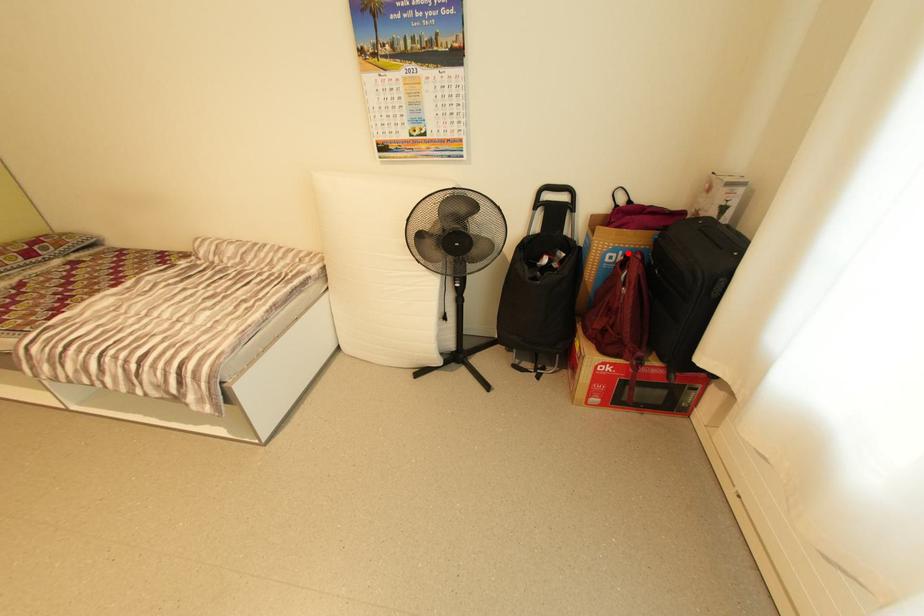
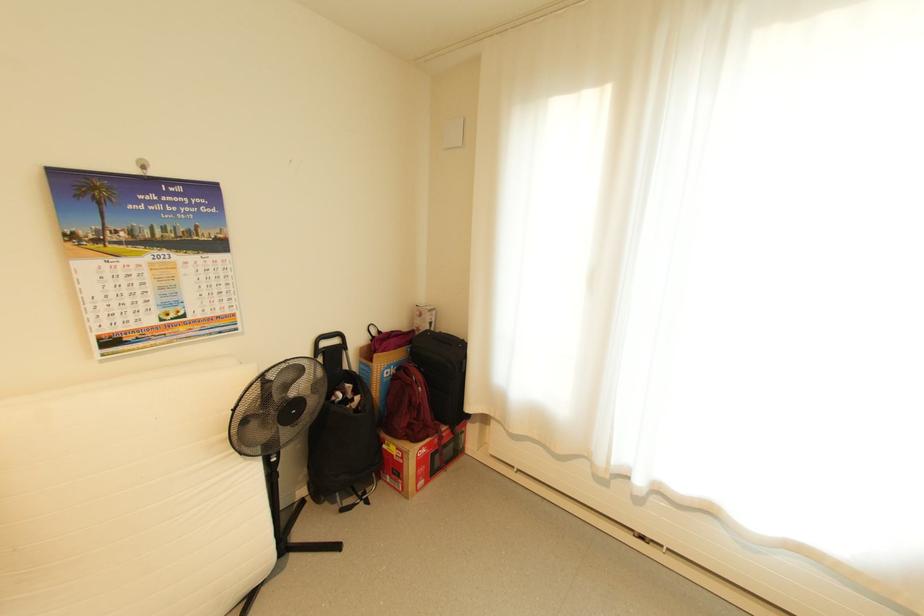
In the second image, find the point that corresponds to the highlighted location in the first image.

(398, 368)